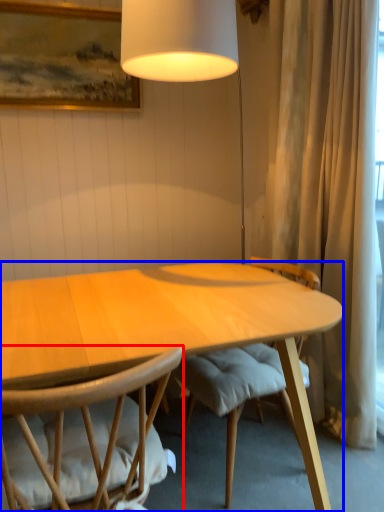
Question: Which of the following is the farthest to the observer, chair (highlighted by a red box) or desk (highlighted by a blue box)?

Choices:
 (A) chair
 (B) desk

Answer: (B)